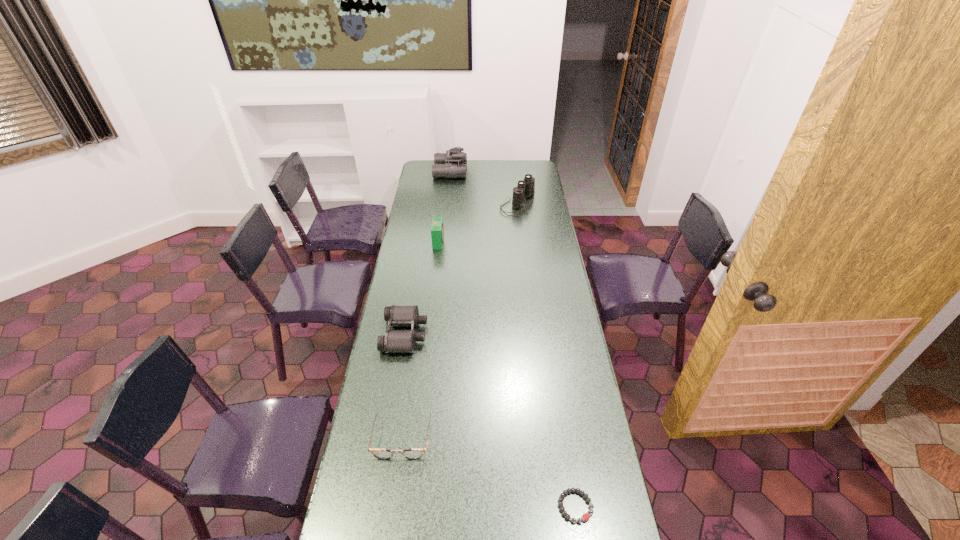
Identify the location of vacant point that satisfies the following two spatial constraints: 1. through the lenses of the farthest object; 2. on the left side of the nearest object. The image size is (960, 540). (415, 506).

Locate an element on the screen. The height and width of the screenshot is (540, 960). vacant space that satisfies the following two spatial constraints: 1. on the front side of the nearest object; 2. on the left side of the second farthest object is located at coordinates (555, 506).

Find the location of `vacant space that satisfies the following two spatial constraints: 1. on the front side of the second farthest binoculars; 2. on the front-facing side of the third tallest object`. vacant space that satisfies the following two spatial constraints: 1. on the front side of the second farthest binoculars; 2. on the front-facing side of the third tallest object is located at coordinates (522, 242).

Locate an element on the screen. The width and height of the screenshot is (960, 540). vacant space that satisfies the following two spatial constraints: 1. through the lenses of the farthest binoculars; 2. on the left side of the nearest object is located at coordinates 415,506.

This screenshot has width=960, height=540. In order to click on blank area in the image that satisfies the following two spatial constraints: 1. on the back side of the second nearest binoculars; 2. through the lenses of the farthest binoculars in this screenshot , I will do `click(514, 172)`.

Where is `free space that satisfies the following two spatial constraints: 1. on the back side of the shortest object; 2. through the eyepieces of the fourth farthest object`? free space that satisfies the following two spatial constraints: 1. on the back side of the shortest object; 2. through the eyepieces of the fourth farthest object is located at coordinates (549, 334).

Find the location of a particular element. This screenshot has height=540, width=960. free space that satisfies the following two spatial constraints: 1. on the frame of the fifth tallest object; 2. on the right side of the shortest object is located at coordinates (393, 506).

Where is `blank space that satisfies the following two spatial constraints: 1. on the back side of the nearest object; 2. through the lenses of the farthest object`? blank space that satisfies the following two spatial constraints: 1. on the back side of the nearest object; 2. through the lenses of the farthest object is located at coordinates click(523, 172).